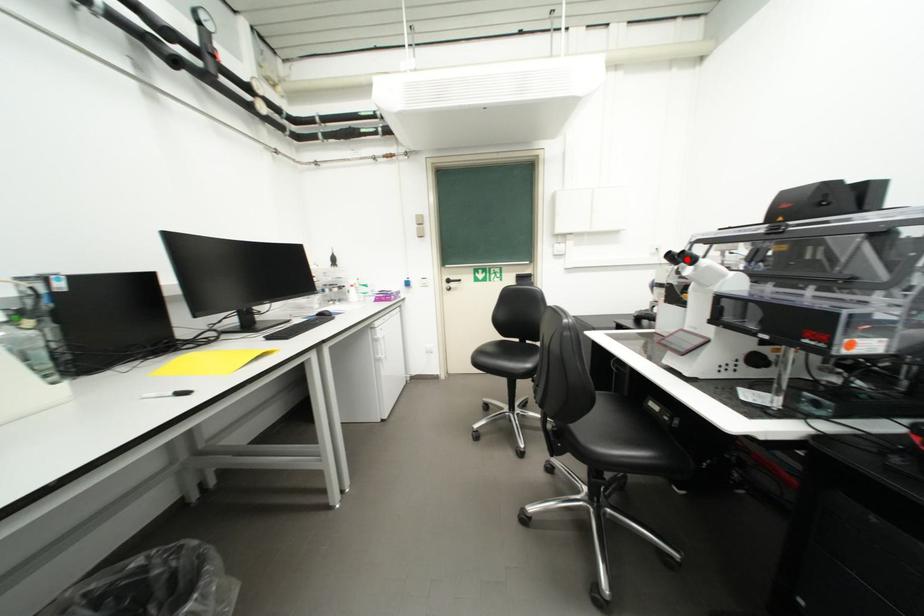
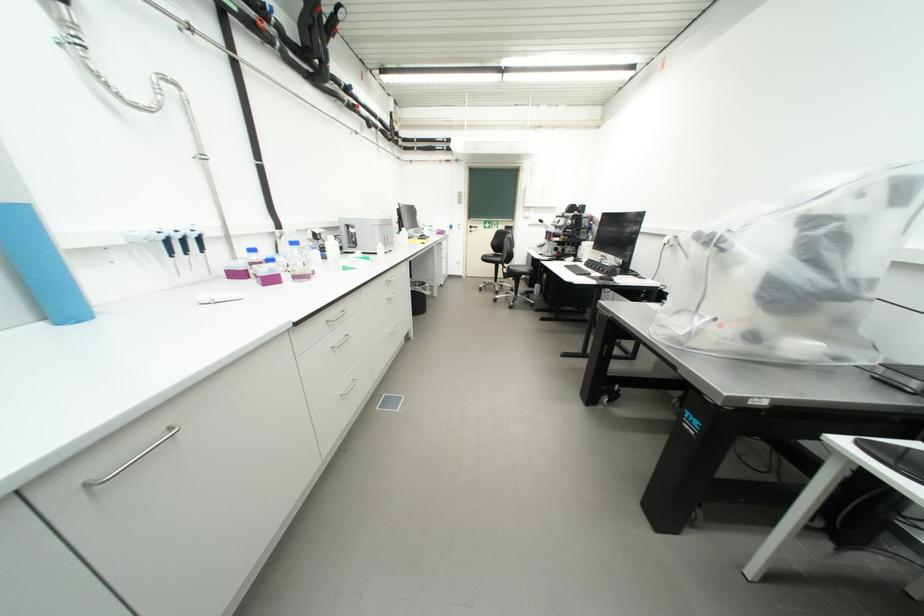
Question: I am providing you with two images of the same scene from different viewpoints. A red point is marked on the first image. Can you still see the location of the red point in image 2?

Choices:
 (A) Yes
 (B) No

Answer: (B)